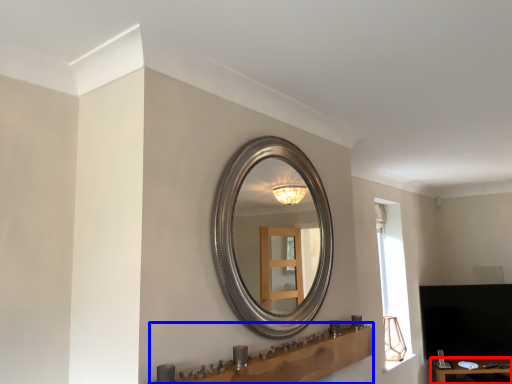
Question: Which object appears farthest to the camera in this image, table (highlighted by a red box) or vanity (highlighted by a blue box)?

Choices:
 (A) table
 (B) vanity

Answer: (A)